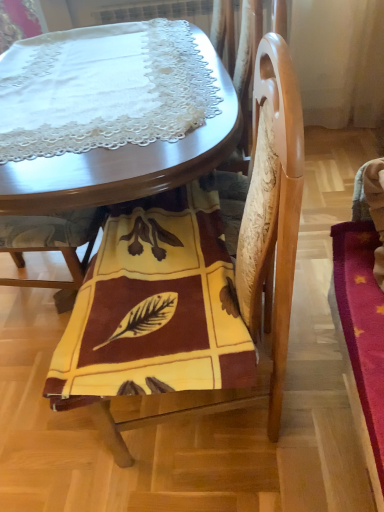
Question: Considering the positions of point (67, 304) and point (213, 373), is point (67, 304) closer or farther from the camera than point (213, 373)?

Choices:
 (A) closer
 (B) farther

Answer: (B)

Question: Looking at the image, does yellow fabric chair at center, marked as the first chair in a left-to-right arrangement, seem bigger or smaller compared to yellow fabric at lower center?

Choices:
 (A) small
 (B) big

Answer: (B)

Question: Which is farther from the yellow fabric chair at center, which appears as the second chair when viewed from the right?

Choices:
 (A) yellow fabric at lower center
 (B) yellow woolen blanket at center, the 1th chair positioned from the right
 (C) wooden table at center

Answer: (B)

Question: Which of these objects is positioned closest to the yellow woolen blanket at center, which is the 2th chair from left to right?

Choices:
 (A) yellow fabric chair at center, marked as the first chair in a left-to-right arrangement
 (B) wooden table at center
 (C) yellow fabric at lower center

Answer: (C)